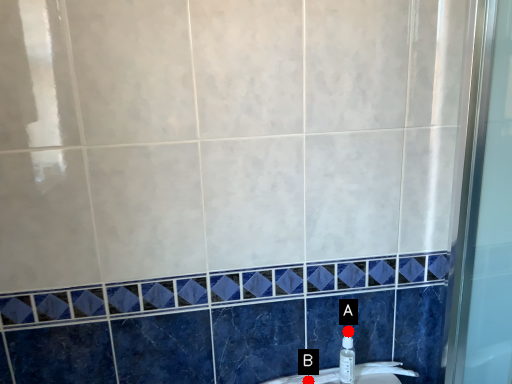
Question: Two points are circled on the image, labeled by A and B beside each circle. Which point is farther to the camera?

Choices:
 (A) A is further
 (B) B is further

Answer: (B)